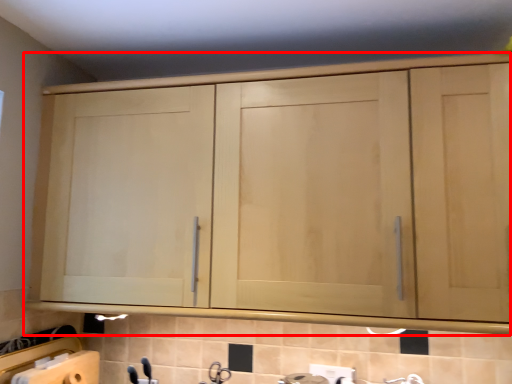
Question: Observing the image, what is the correct spatial positioning of cupboard (annotated by the red box) in reference to faucet?

Choices:
 (A) right
 (B) left

Answer: (A)